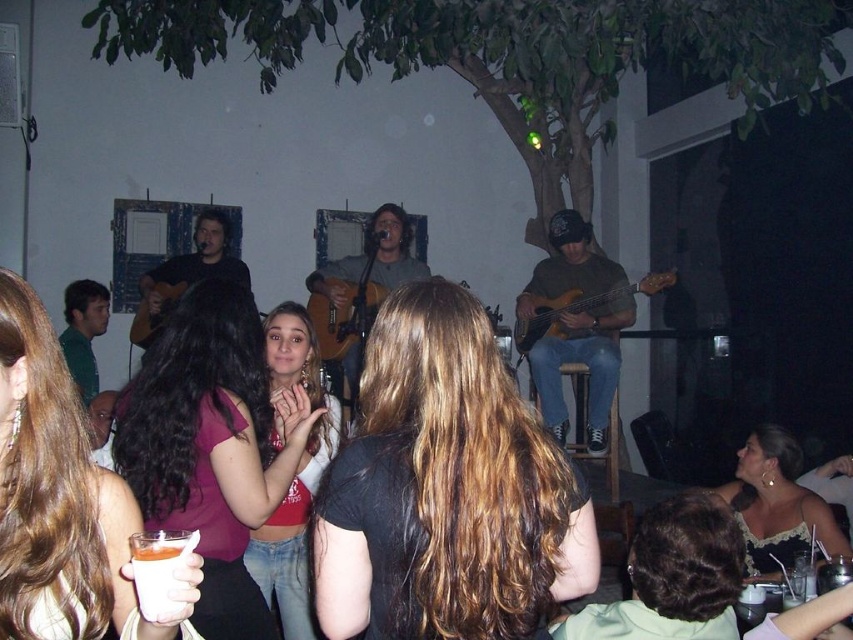
Question: Is matte pink shirt at center behind pink fabric shirt at center?

Choices:
 (A) yes
 (B) no

Answer: (A)

Question: Does pink fabric shirt at center have a greater width compared to matte red shirt at center?

Choices:
 (A) yes
 (B) no

Answer: (A)

Question: Does pink fabric shirt at center have a larger size compared to matte red shirt at center?

Choices:
 (A) yes
 (B) no

Answer: (B)

Question: Which point appears farthest from the camera in this image?

Choices:
 (A) (165, 589)
 (B) (651, 291)
 (C) (811, 525)

Answer: (B)

Question: Which point appears farthest from the camera in this image?

Choices:
 (A) (73, 468)
 (B) (334, 282)

Answer: (B)

Question: Which point is closer to the camera?

Choices:
 (A) (753, 508)
 (B) (82, 586)
 (C) (245, 522)
 (D) (148, 556)

Answer: (D)